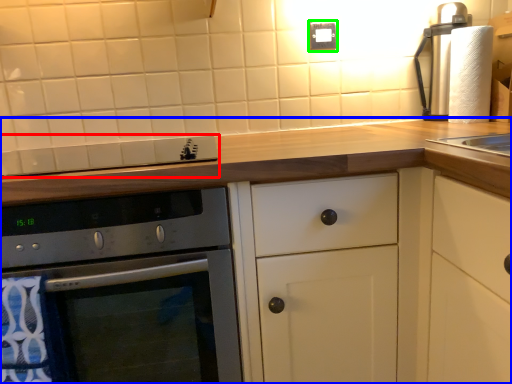
Question: Which object is the closest to the gas stove (highlighted by a red box)? Choose among these: cabinetry (highlighted by a blue box) or electric outlet (highlighted by a green box).

Choices:
 (A) cabinetry
 (B) electric outlet

Answer: (A)